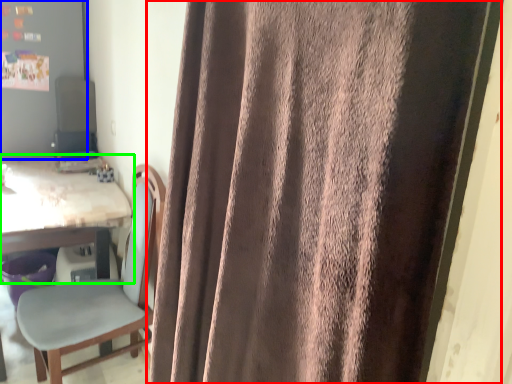
Question: Which object is positioned farthest from curtain (highlighted by a red box)? Select from bulletin board (highlighted by a blue box) and table (highlighted by a green box).

Choices:
 (A) bulletin board
 (B) table

Answer: (A)